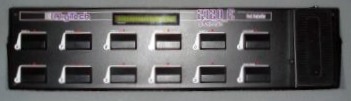
At what (x,y) coordinates should I click in order to perform the action: click on screws. Please return your answer as a coordinate pair (x, y). The width and height of the screenshot is (351, 101). Looking at the image, I should click on (287, 59), (315, 75), (332, 13), (314, 5).